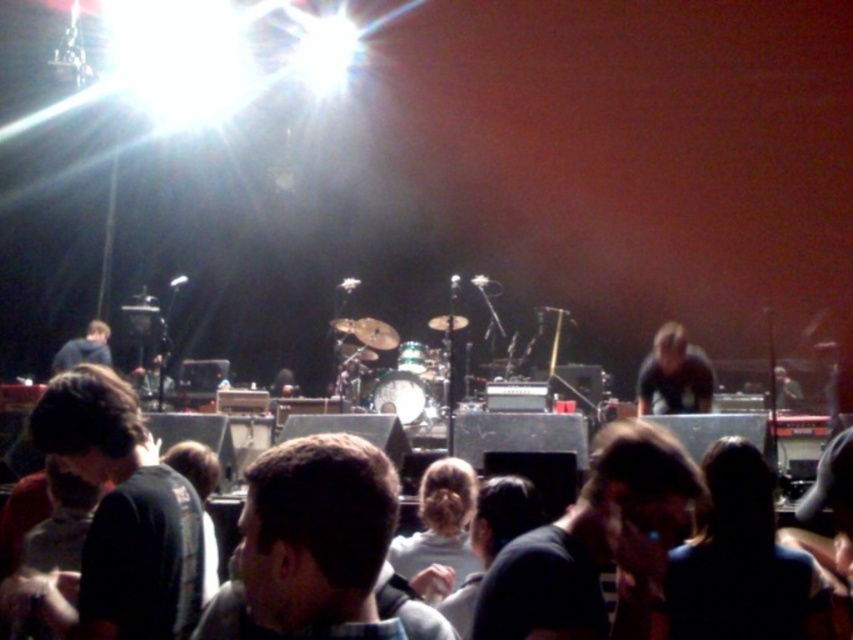
You are standing in the audience at the concert and want to know how far the point at coordinates point (485, 584) is from you. Can you determine the distance?

The distance of point (485, 584) from camera is 2.86 meters, so the point is 2.86 meters away from you.

You are a photographer at the concert and want to capture a closeup of the musician. You notice the black matte shirt at center and the brown hair at center in your viewfinder. Which object should you focus on to ensure the other is also in frame?

You should focus on the brown hair at center because the black matte shirt at center is to the left of it, so keeping the brown hair centered will keep both in frame.